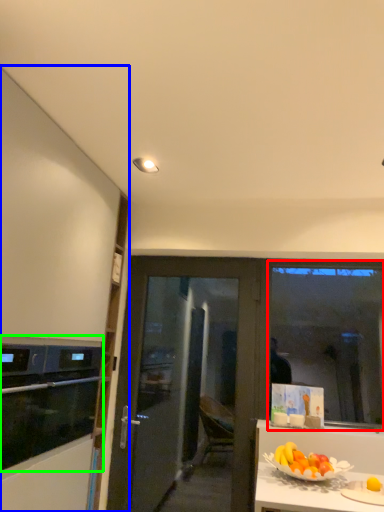
Question: Based on their relative distances, which object is nearer to window screen (highlighted by a red box)? Choose from cabinetry (highlighted by a blue box) and kitchen appliance (highlighted by a green box).

Choices:
 (A) cabinetry
 (B) kitchen appliance

Answer: (B)